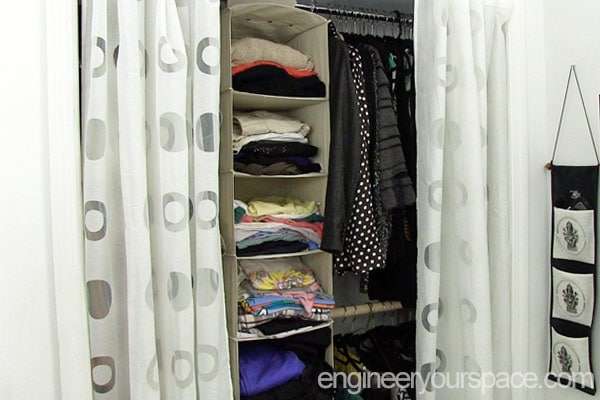
Locate an element on the screen. clothes hanger rods is located at coordinates (365, 305), (345, 10).